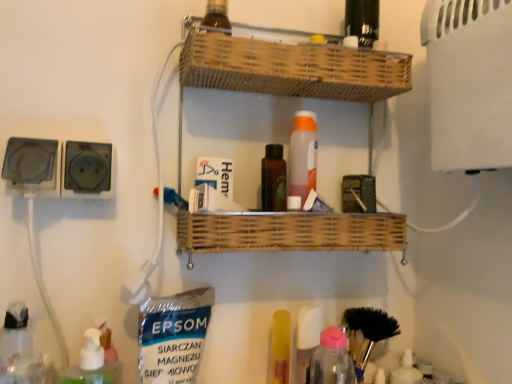
Question: Looking at their shapes, would you say black plastic socket at left, positioned as the 2th electric outlet in right-to-left order, is wider or thinner than brown glass bottle at upper center?

Choices:
 (A) thin
 (B) wide

Answer: (A)

Question: From the image's perspective, relative to brown glass bottle at upper center, is black plastic socket at left, positioned as the 2th electric outlet in right-to-left order, above or below?

Choices:
 (A) below
 (B) above

Answer: (A)

Question: Which object is positioned farthest from the black plastic socket at left, positioned as the 2th electric outlet in right-to-left order?

Choices:
 (A) brown glass bottle at upper center
 (B) black bristle brush at lower right
 (C) yellow plastic tube at lower center
 (D) black plastic socket at left, placed as the second electric outlet when sorted from left to right
 (E) woven wood shelf at center

Answer: (B)

Question: Which object is positioned closest to the yellow plastic tube at lower center?

Choices:
 (A) black plastic socket at left, placed as the second electric outlet when sorted from left to right
 (B) brown glass bottle at upper center
 (C) black bristle brush at lower right
 (D) woven wood shelf at center
 (E) black plastic socket at left, positioned as the 2th electric outlet in right-to-left order

Answer: (C)